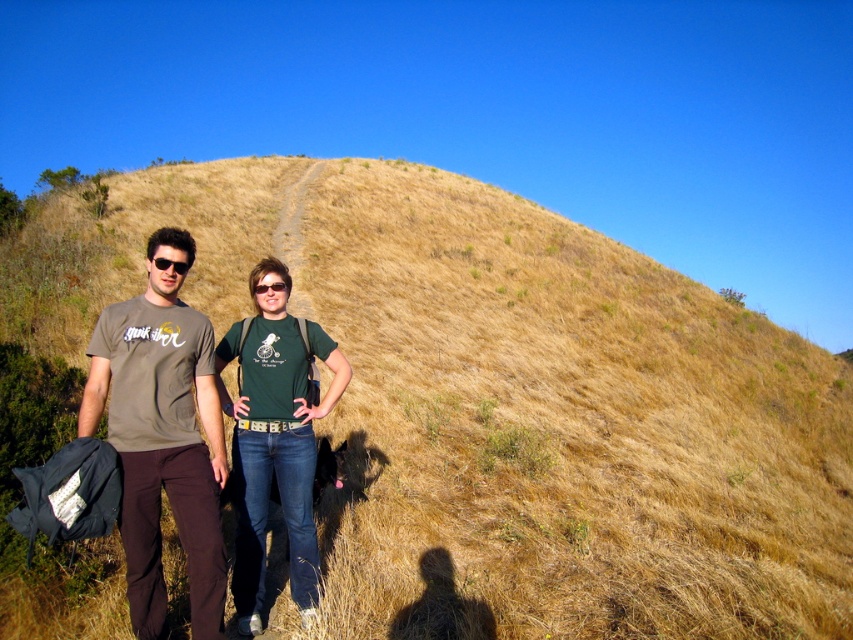
Does matte brown t-shirt at left have a lesser height compared to black matte sunglasses at center?

No.

Does point (126, 458) come closer to viewer compared to point (279, 284)?

That is True.

Does point (125, 360) come farther from viewer compared to point (283, 285)?

No, it is not.

Locate an element on the screen. The image size is (853, 640). matte brown t-shirt at left is located at coordinates (161, 438).

Can you confirm if matte brown t-shirt at left is positioned to the left of green cotton shirt at center?

Yes, matte brown t-shirt at left is to the left of green cotton shirt at center.

Does matte brown t-shirt at left have a smaller size compared to green cotton shirt at center?

Indeed, matte brown t-shirt at left has a smaller size compared to green cotton shirt at center.

At what (x,y) coordinates should I click in order to perform the action: click on matte brown t-shirt at left. Please return your answer as a coordinate pair (x, y). This screenshot has width=853, height=640. Looking at the image, I should click on (161, 438).

Between matte brown t-shirt at left and black plastic sunglasses at left, which one has less height?

With less height is black plastic sunglasses at left.

Who is taller, matte brown t-shirt at left or black plastic sunglasses at left?

matte brown t-shirt at left is taller.

Is point (120, 339) positioned before point (155, 262)?

Yes, it is in front of point (155, 262).

Find the location of `matte brown t-shirt at left`. matte brown t-shirt at left is located at coordinates (161, 438).